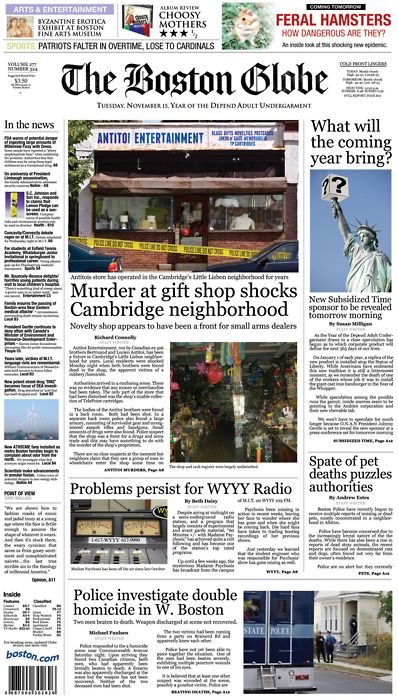
The width and height of the screenshot is (398, 700). Find the location of `windows`. windows is located at coordinates (135, 208), (242, 204).